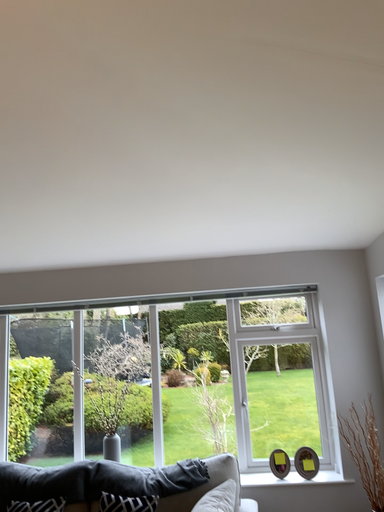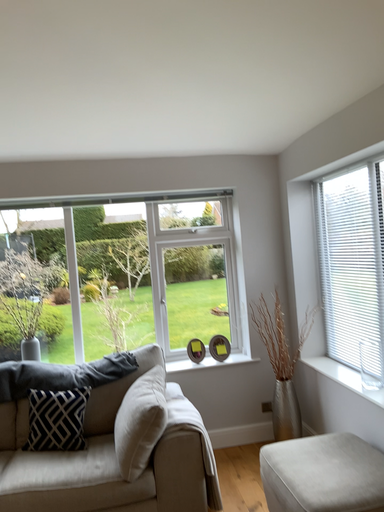
Question: Which way did the camera rotate in the video?

Choices:
 (A) rotated upward
 (B) rotated downward

Answer: (B)